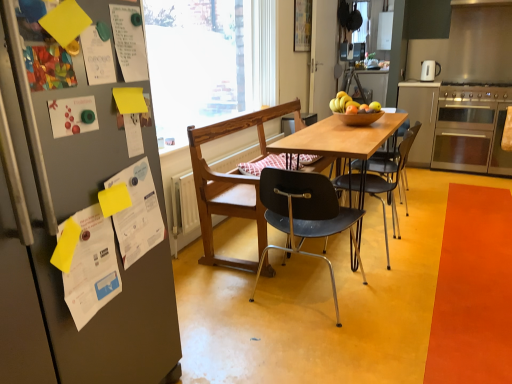
I want to click on vacant region to the right of black plastic chair at center, which appears as the 3th chair when viewed from the back, so click(x=411, y=297).